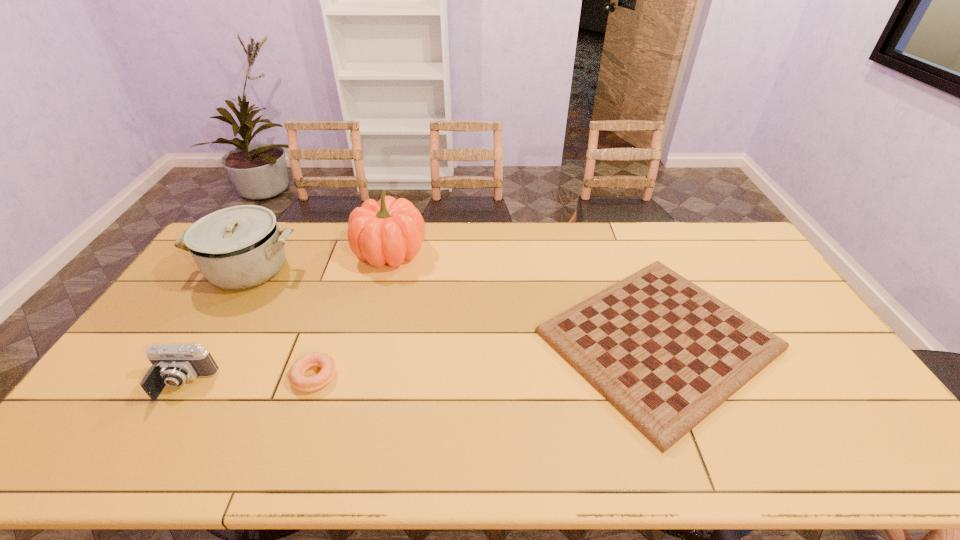
Identify the location of free space that is in between the rightmost object and the bagel. The height and width of the screenshot is (540, 960). (487, 358).

The width and height of the screenshot is (960, 540). Identify the location of free spot between the third shortest object and the second tallest object. (216, 327).

Where is `object that is the nearest to the fourth shortest object`? This screenshot has height=540, width=960. object that is the nearest to the fourth shortest object is located at coordinates (391, 230).

Locate an element on the screen. object that ranks as the fourth closest to the gameboard is located at coordinates tap(172, 364).

The height and width of the screenshot is (540, 960). In order to click on free spot that satisfies the following two spatial constraints: 1. on the front side of the tallest object; 2. on the right side of the gameboard in this screenshot , I will do `click(368, 340)`.